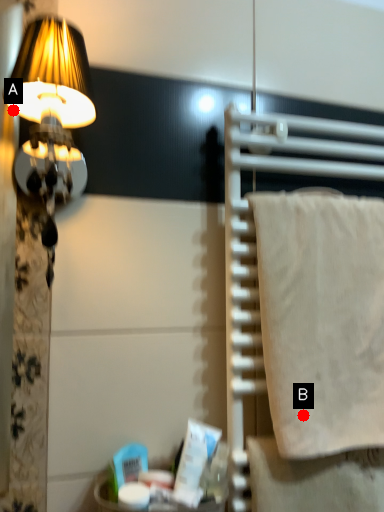
Question: Two points are circled on the image, labeled by A and B beside each circle. Which point appears farthest from the camera in this image?

Choices:
 (A) A is further
 (B) B is further

Answer: (B)